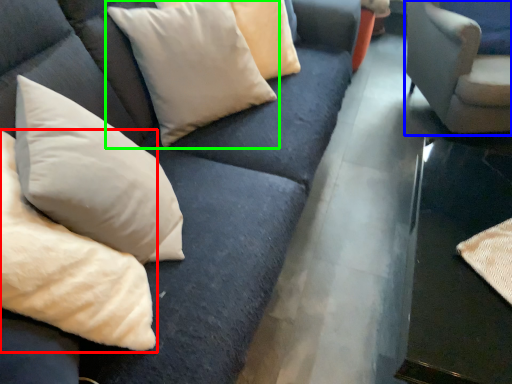
Question: Based on their relative distances, which object is nearer to pillow (highlighted by a red box)? Choose from chair (highlighted by a blue box) and pillow (highlighted by a green box).

Choices:
 (A) chair
 (B) pillow

Answer: (B)